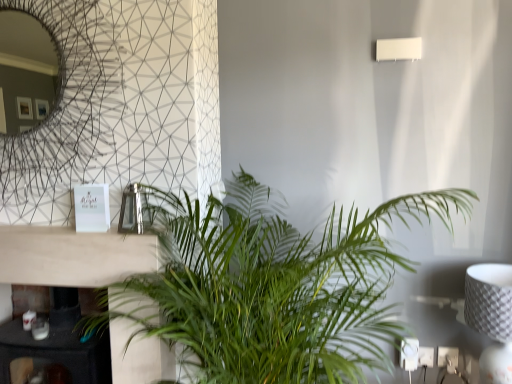
Question: Could you tell me if white textured lampshade at right is facing white matte rectangular lamp at upper right?

Choices:
 (A) yes
 (B) no

Answer: (B)

Question: Considering the relative positions of white textured lampshade at right and white matte rectangular lamp at upper right in the image provided, is white textured lampshade at right in front of white matte rectangular lamp at upper right?

Choices:
 (A) yes
 (B) no

Answer: (A)

Question: Considering the relative positions of white textured lampshade at right and white matte rectangular lamp at upper right in the image provided, is white textured lampshade at right to the left of white matte rectangular lamp at upper right from the viewer's perspective?

Choices:
 (A) no
 (B) yes

Answer: (A)

Question: Considering the relative sizes of white textured lampshade at right and white matte rectangular lamp at upper right in the image provided, is white textured lampshade at right bigger than white matte rectangular lamp at upper right?

Choices:
 (A) no
 (B) yes

Answer: (B)

Question: Is white textured lampshade at right positioned beyond the bounds of white matte rectangular lamp at upper right?

Choices:
 (A) yes
 (B) no

Answer: (A)

Question: From a real-world perspective, is white textured lampshade at right physically above white matte rectangular lamp at upper right?

Choices:
 (A) no
 (B) yes

Answer: (A)

Question: Is the position of black marble fireplace at lower left more distant than that of white matte rectangular lamp at upper right?

Choices:
 (A) yes
 (B) no

Answer: (B)

Question: Is black marble fireplace at lower left in front of white matte rectangular lamp at upper right?

Choices:
 (A) no
 (B) yes

Answer: (B)

Question: Is black marble fireplace at lower left bigger than white matte rectangular lamp at upper right?

Choices:
 (A) no
 (B) yes

Answer: (B)

Question: From the image's perspective, is black marble fireplace at lower left under white matte rectangular lamp at upper right?

Choices:
 (A) yes
 (B) no

Answer: (A)

Question: Is black marble fireplace at lower left next to white matte rectangular lamp at upper right and touching it?

Choices:
 (A) no
 (B) yes

Answer: (A)

Question: From a real-world perspective, is black marble fireplace at lower left beneath white matte rectangular lamp at upper right?

Choices:
 (A) yes
 (B) no

Answer: (A)

Question: Can you confirm if black marble fireplace at lower left is smaller than green leafy plant at center?

Choices:
 (A) yes
 (B) no

Answer: (A)